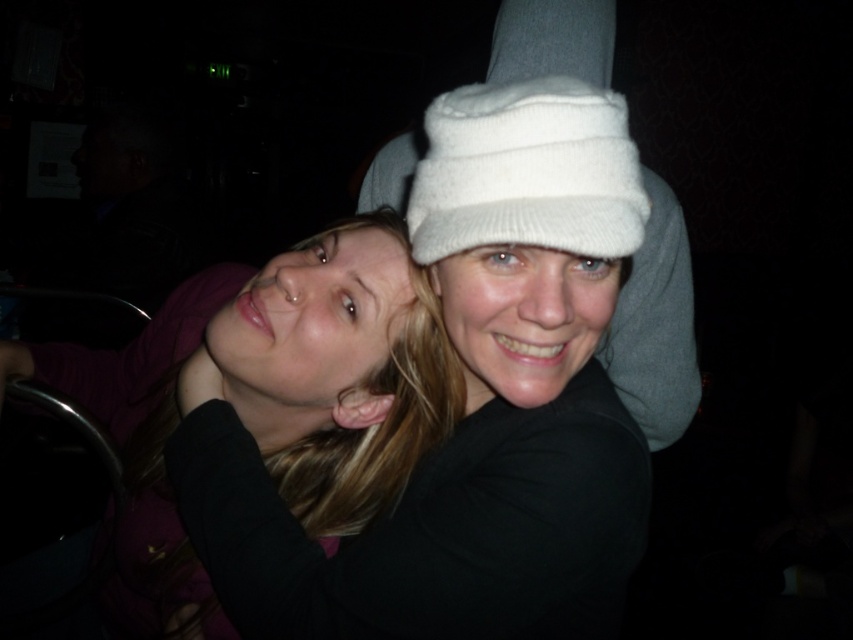
Between matte black hair at center and white knitted hat at upper center, which one has more height?

white knitted hat at upper center

Consider the image. Who is more forward, (398, 253) or (683, 237)?

Positioned in front is point (398, 253).

Locate an element on the screen. matte black hair at center is located at coordinates (273, 396).

Does white knitted hat at center have a smaller size compared to white knitted hat at upper center?

Correct, white knitted hat at center occupies less space than white knitted hat at upper center.

Can you confirm if white knitted hat at center is wider than white knitted hat at upper center?

No.

Who is more forward, (538, 173) or (589, 70)?

Point (538, 173) is in front.

You are a GUI agent. You are given a task and a screenshot of the screen. Output one action in this format:
    pyautogui.click(x=<x>, y=<y>)
    Task: Click on the white knitted hat at center
    The height and width of the screenshot is (640, 853).
    Given the screenshot: What is the action you would take?
    pyautogui.click(x=527, y=172)

Is matte black hair at center taller than white knitted hat at center?

Indeed, matte black hair at center has a greater height compared to white knitted hat at center.

Who is more distant from viewer, [128,568] or [453,234]?

The point [128,568] is behind.

Locate an element on the screen. matte black hair at center is located at coordinates (273, 396).